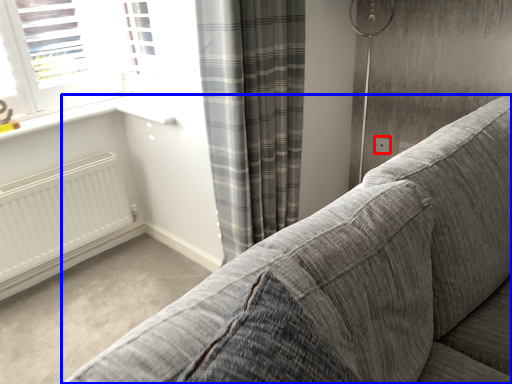
Question: Which object appears closest to the camera in this image, electric outlet (highlighted by a red box) or studio couch (highlighted by a blue box)?

Choices:
 (A) electric outlet
 (B) studio couch

Answer: (B)